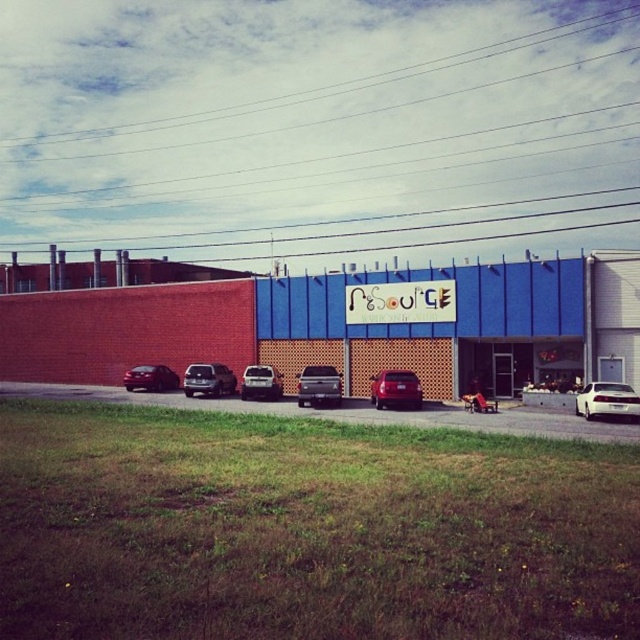
Question: Based on their relative distances, which object is farther from the shiny black sedan at left?

Choices:
 (A) satin silver suv at center
 (B) green grass at lower center
 (C) metallic silver truck at center
 (D) satin black suv at center

Answer: (B)

Question: Does green grass at lower center lie in front of satin silver suv at center?

Choices:
 (A) no
 (B) yes

Answer: (B)

Question: Is the position of white glossy car at right more distant than that of shiny black sedan at left?

Choices:
 (A) yes
 (B) no

Answer: (B)

Question: Which point is closer to the camera taking this photo?

Choices:
 (A) (x=273, y=392)
 (B) (x=125, y=436)

Answer: (B)

Question: Does glossy red car at center appear under shiny black sedan at left?

Choices:
 (A) yes
 (B) no

Answer: (B)

Question: Which point appears closest to the camera in this image?

Choices:
 (A) (376, 404)
 (B) (602, 397)
 (C) (326, 396)

Answer: (B)